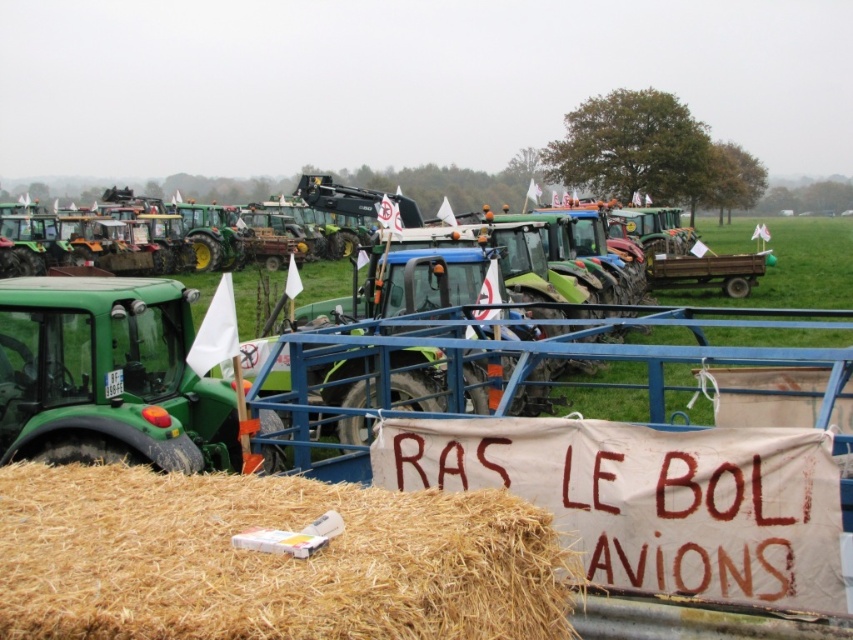
Question: Is straw bale at lower center above white fabric banner at center?

Choices:
 (A) no
 (B) yes

Answer: (A)

Question: Is straw bale at lower center further to camera compared to white fabric banner at center?

Choices:
 (A) yes
 (B) no

Answer: (B)

Question: Which of the following is the farthest from the observer?

Choices:
 (A) (347, 524)
 (B) (469, 426)

Answer: (B)

Question: Which point is closer to the camera?

Choices:
 (A) straw bale at lower center
 (B) white fabric banner at center

Answer: (A)

Question: Which point is closer to the camera?

Choices:
 (A) straw bale at lower center
 (B) white fabric banner at center

Answer: (A)

Question: Does straw bale at lower center appear on the left side of white fabric banner at center?

Choices:
 (A) no
 (B) yes

Answer: (B)